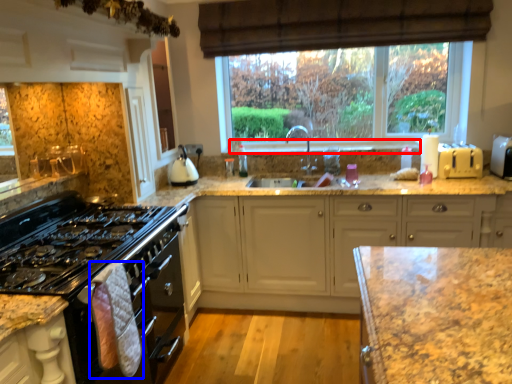
Question: Which point is further to the camera, window sill (highlighted by a red box) or material (highlighted by a blue box)?

Choices:
 (A) window sill
 (B) material

Answer: (A)